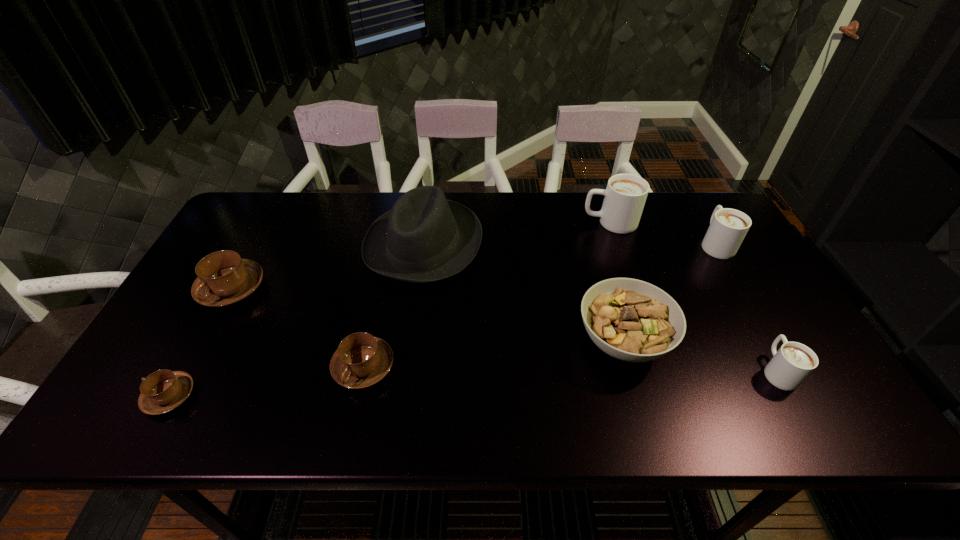
In the image, there is a desktop. At what (x,y) coordinates should I click in order to perform the action: click on free space at the near edge. Please return your answer as a coordinate pair (x, y). Looking at the image, I should click on (595, 400).

In the image, there is a desktop. At what (x,y) coordinates should I click in order to perform the action: click on free space at the right edge. Please return your answer as a coordinate pair (x, y). Looking at the image, I should click on (732, 280).

The image size is (960, 540). In order to click on vacant space at the far left corner of the desktop in this screenshot , I will do `click(279, 204)`.

Find the location of `vacant space in between the fedora and the third cappuccino from right to left`. vacant space in between the fedora and the third cappuccino from right to left is located at coordinates (516, 233).

The image size is (960, 540). Identify the location of free point between the second tallest cappuccino and the farthest brown cappuccino. (473, 266).

Locate an element on the screen. vacant area that lies between the gray fedora and the biggest brown cappuccino is located at coordinates (327, 266).

Where is `free space between the farthest brown cappuccino and the nearest white cappuccino`? free space between the farthest brown cappuccino and the nearest white cappuccino is located at coordinates (505, 329).

Image resolution: width=960 pixels, height=540 pixels. Find the location of `vacant region between the stew and the smallest brown cappuccino`. vacant region between the stew and the smallest brown cappuccino is located at coordinates (396, 368).

At what (x,y) coordinates should I click in order to perform the action: click on vacant region between the third cappuccino from right to left and the seventh tallest object. Please return your answer as a coordinate pair (x, y). Looking at the image, I should click on (487, 294).

I want to click on free space between the shortest cappuccino and the gray stew, so click(x=396, y=368).